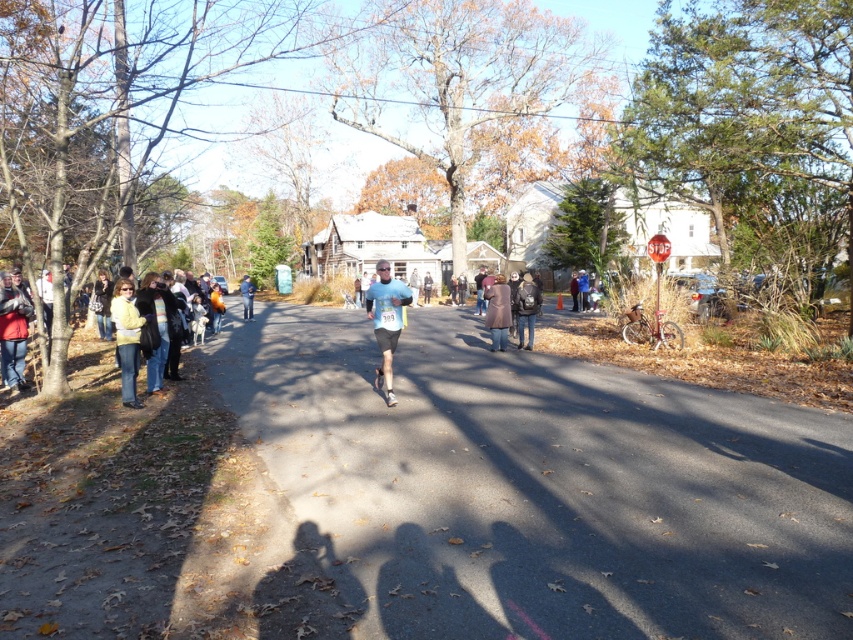
Question: Which is nearer to the red jacket at left?

Choices:
 (A) blue fabric jacket at center
 (B) yellow sweater at left
 (C) light blue fabric shirt at center
 (D) light gray asphalt road at center

Answer: (B)

Question: Does light blue fabric shirt at center come in front of red jacket at left?

Choices:
 (A) no
 (B) yes

Answer: (B)

Question: Which object appears farthest from the camera in this image?

Choices:
 (A) leather jacket at center
 (B) yellow sweater at left

Answer: (A)

Question: Is light gray asphalt road at center to the left of leather jacket at center from the viewer's perspective?

Choices:
 (A) yes
 (B) no

Answer: (A)

Question: Does brown wool coat at center appear on the right side of leather jacket at center?

Choices:
 (A) no
 (B) yes

Answer: (A)

Question: Which point appears closest to the camera in this image?

Choices:
 (A) (242, 289)
 (B) (508, 310)
 (C) (6, 275)
 (D) (531, 300)

Answer: (C)